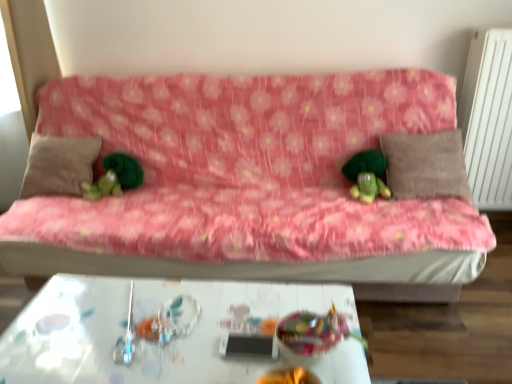
Question: Should I look upward or downward to see translucent plastic bowl at center, the 1th toy when ordered from right to left?

Choices:
 (A) down
 (B) up

Answer: (A)

Question: Would you say beige fabric pillow at left, which is the 1th pillow from left to right, is a long distance from brown fabric pillow at right, placed as the 1th pillow when sorted from right to left?

Choices:
 (A) yes
 (B) no

Answer: (A)

Question: Is beige fabric pillow at left, the second pillow viewed from the right, to the left of brown fabric pillow at right, placed as the 1th pillow when sorted from right to left, from the viewer's perspective?

Choices:
 (A) yes
 (B) no

Answer: (A)

Question: Does beige fabric pillow at left, which is the 1th pillow from left to right, have a greater width compared to brown fabric pillow at right, placed as the 1th pillow when sorted from right to left?

Choices:
 (A) yes
 (B) no

Answer: (A)

Question: Considering the relative positions of beige fabric pillow at left, which is the 1th pillow from left to right, and brown fabric pillow at right, placed as the 1th pillow when sorted from right to left, in the image provided, is beige fabric pillow at left, which is the 1th pillow from left to right, to the right of brown fabric pillow at right, placed as the 1th pillow when sorted from right to left, from the viewer's perspective?

Choices:
 (A) yes
 (B) no

Answer: (B)

Question: Does beige fabric pillow at left, the second pillow viewed from the right, come in front of brown fabric pillow at right, which appears as the 2th pillow when viewed from the left?

Choices:
 (A) yes
 (B) no

Answer: (B)

Question: Is beige fabric pillow at left, which is the 1th pillow from left to right, not inside brown fabric pillow at right, placed as the 1th pillow when sorted from right to left?

Choices:
 (A) yes
 (B) no

Answer: (A)

Question: Does white textured radiator at right turn towards beige fabric pillow at left, which is the 1th pillow from left to right?

Choices:
 (A) yes
 (B) no

Answer: (B)

Question: Is the position of white textured radiator at right more distant than that of beige fabric pillow at left, the second pillow viewed from the right?

Choices:
 (A) no
 (B) yes

Answer: (A)

Question: Is beige fabric pillow at left, the second pillow viewed from the right, completely or partially inside white textured radiator at right?

Choices:
 (A) no
 (B) yes

Answer: (A)

Question: Does white textured radiator at right have a smaller size compared to beige fabric pillow at left, which is the 1th pillow from left to right?

Choices:
 (A) yes
 (B) no

Answer: (B)

Question: Is white textured radiator at right next to beige fabric pillow at left, which is the 1th pillow from left to right?

Choices:
 (A) yes
 (B) no

Answer: (B)

Question: From the image's perspective, is white textured radiator at right below beige fabric pillow at left, the second pillow viewed from the right?

Choices:
 (A) yes
 (B) no

Answer: (B)

Question: Does green plush toy at left, the second toy when ordered from bottom to top, have a larger size compared to brown fabric pillow at right, placed as the 1th pillow when sorted from right to left?

Choices:
 (A) no
 (B) yes

Answer: (A)